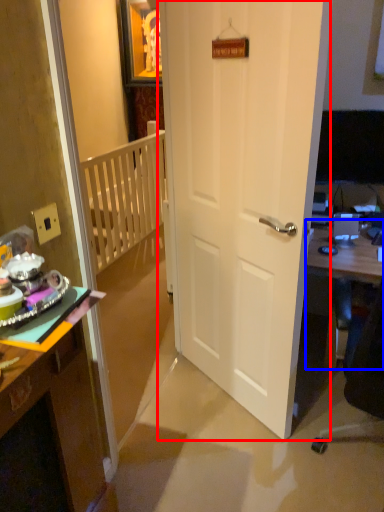
Question: Which object appears farthest to the camera in this image, door (highlighted by a red box) or table (highlighted by a blue box)?

Choices:
 (A) door
 (B) table

Answer: (B)